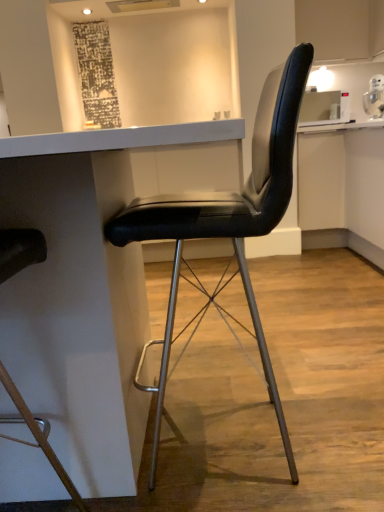
Where is `vacant space to the right of black leather chair at center, the 1th chair when ordered from right to left`? vacant space to the right of black leather chair at center, the 1th chair when ordered from right to left is located at coordinates (347, 410).